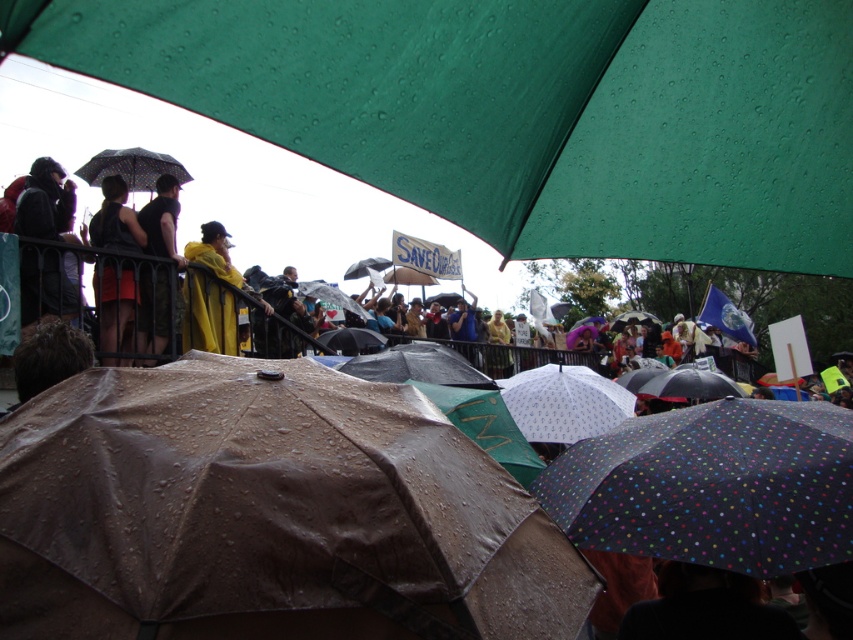
Question: Which point is closer to the camera taking this photo?

Choices:
 (A) (218, 422)
 (B) (554, 406)
 (C) (793, 572)

Answer: (A)

Question: Does matte black shorts at left appear under transparent plastic umbrella at upper left?

Choices:
 (A) yes
 (B) no

Answer: (A)

Question: Does white dotted umbrella at center appear on the right side of dark brown leather jacket at upper left?

Choices:
 (A) yes
 (B) no

Answer: (A)

Question: Is polka dot fabric umbrella at lower right in front of dark gray jacket at left?

Choices:
 (A) no
 (B) yes

Answer: (B)

Question: Which object is positioned farthest from the transparent plastic umbrella at upper left?

Choices:
 (A) white dotted umbrella at center
 (B) green matte umbrella at upper center

Answer: (B)

Question: Estimate the real-world distances between objects in this image. Which object is closer to the polka dot fabric umbrella at lower right?

Choices:
 (A) white dotted umbrella at center
 (B) dark brown leather jacket at upper left
 (C) matte black shorts at left
 (D) brown matte umbrella at center

Answer: (D)